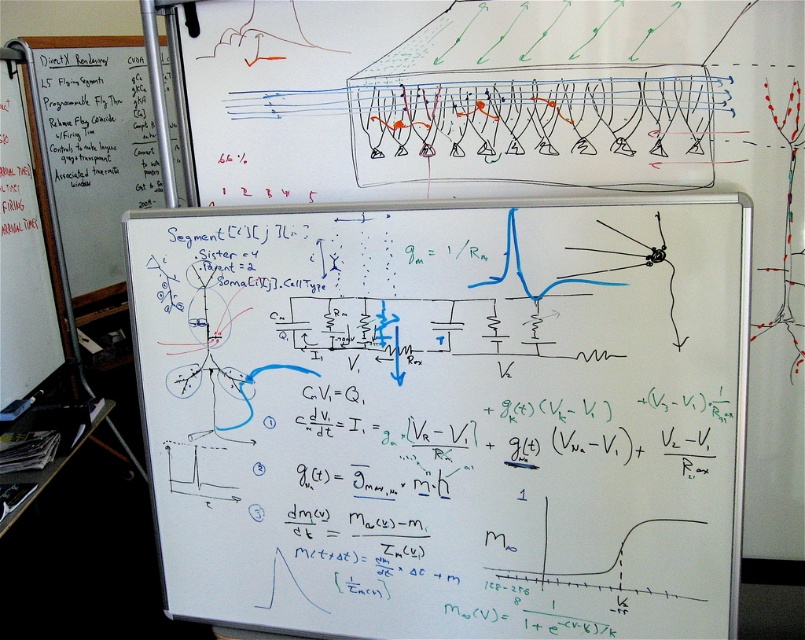
Question: Which of the following is the farthest from the observer?

Choices:
 (A) whiteboard at center
 (B) whiteboard paper at left

Answer: (B)

Question: Is whiteboard at center further to the viewer compared to whiteboard paper at left?

Choices:
 (A) yes
 (B) no

Answer: (B)

Question: Observing the image, what is the correct spatial positioning of whiteboard at center in reference to whiteboard paper at left?

Choices:
 (A) above
 (B) below

Answer: (B)

Question: Which of the following is the closest to the observer?

Choices:
 (A) (178, 266)
 (B) (120, 76)

Answer: (A)

Question: Is whiteboard at center further to the viewer compared to whiteboard paper at left?

Choices:
 (A) no
 (B) yes

Answer: (A)